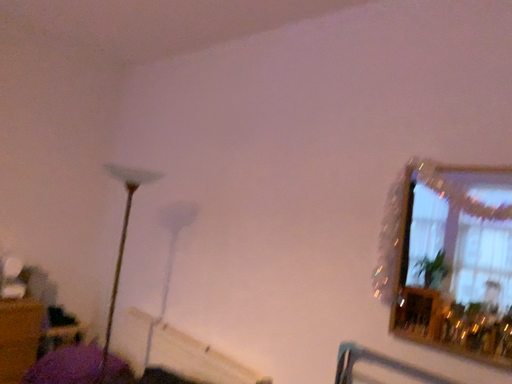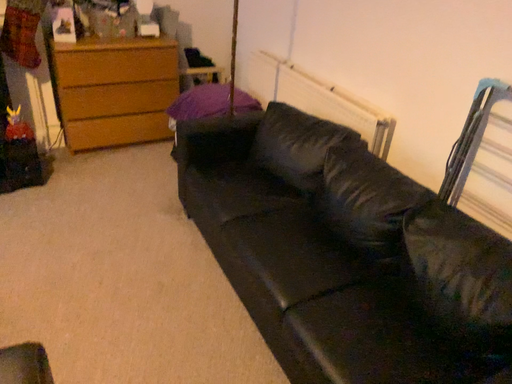
Question: Which way did the camera rotate in the video?

Choices:
 (A) rotated left
 (B) rotated right

Answer: (A)